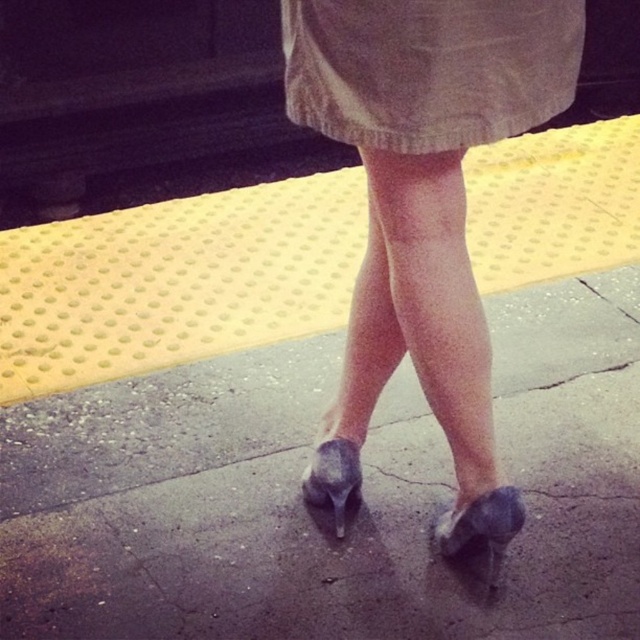
Question: Does knit fabric skirt at center have a larger size compared to suede-like gray shoe at lower center?

Choices:
 (A) no
 (B) yes

Answer: (B)

Question: Considering the real-world distances, which object is closest to the gray concrete sidewalk at center?

Choices:
 (A) knit fabric skirt at center
 (B) suede-like gray shoe at lower center

Answer: (B)

Question: Which of the following is the farthest from the observer?

Choices:
 (A) suede high heels at center
 (B) knit fabric skirt at center
 (C) suede-like gray shoe at lower center
 (D) gray concrete sidewalk at center

Answer: (C)

Question: Is suede high heels at center positioned behind suede high-heeled shoe at center?

Choices:
 (A) yes
 (B) no

Answer: (B)

Question: Among these objects, which one is nearest to the camera?

Choices:
 (A) knit fabric skirt at center
 (B) suede high heels at center

Answer: (A)

Question: Can you confirm if gray concrete sidewalk at center is positioned above suede-like gray shoe at lower center?

Choices:
 (A) no
 (B) yes

Answer: (B)